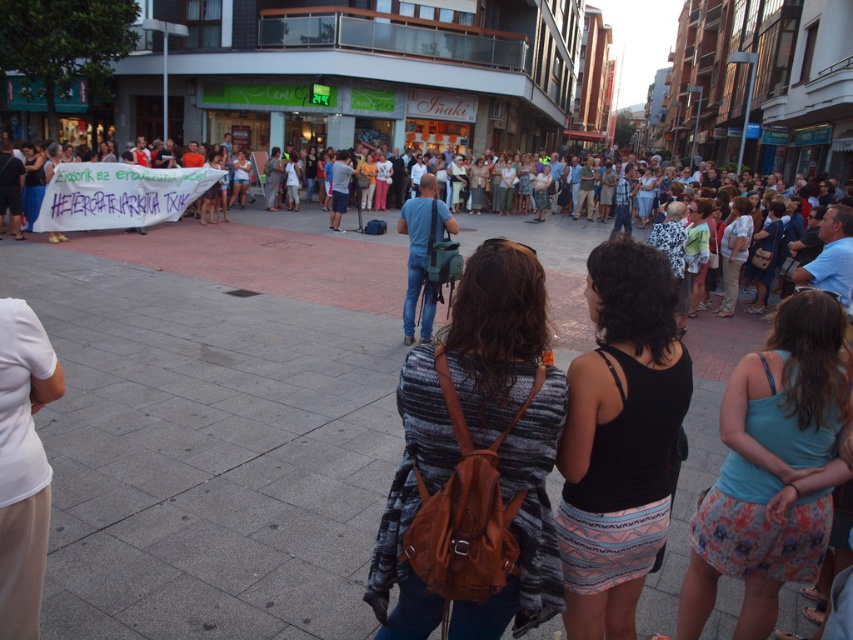
Can you confirm if gray concrete pavement at center is bigger than denim jeans at center?

Yes, gray concrete pavement at center is bigger than denim jeans at center.

Who is positioned more to the right, gray concrete pavement at center or denim jeans at center?

From the viewer's perspective, denim jeans at center appears more on the right side.

Image resolution: width=853 pixels, height=640 pixels. I want to click on gray concrete pavement at center, so click(x=216, y=424).

From the picture: Who is more distant from viewer, (86,433) or (7,371)?

The point (86,433) is more distant.

Is gray concrete pavement at center thinner than white fabric at left?

No, gray concrete pavement at center is not thinner than white fabric at left.

At what (x,y) coordinates should I click in order to perform the action: click on gray concrete pavement at center. Please return your answer as a coordinate pair (x, y). Looking at the image, I should click on (216, 424).

Identify the location of gray concrete pavement at center. The height and width of the screenshot is (640, 853). (216, 424).

How far apart are gray concrete pavement at center and white cotton shirt at center?

9.71 feet

Who is lower down, gray concrete pavement at center or white cotton shirt at center?

gray concrete pavement at center

Between point (209, 564) and point (325, 237), which one is positioned behind?

Point (325, 237)

In order to click on gray concrete pavement at center in this screenshot , I will do `click(216, 424)`.